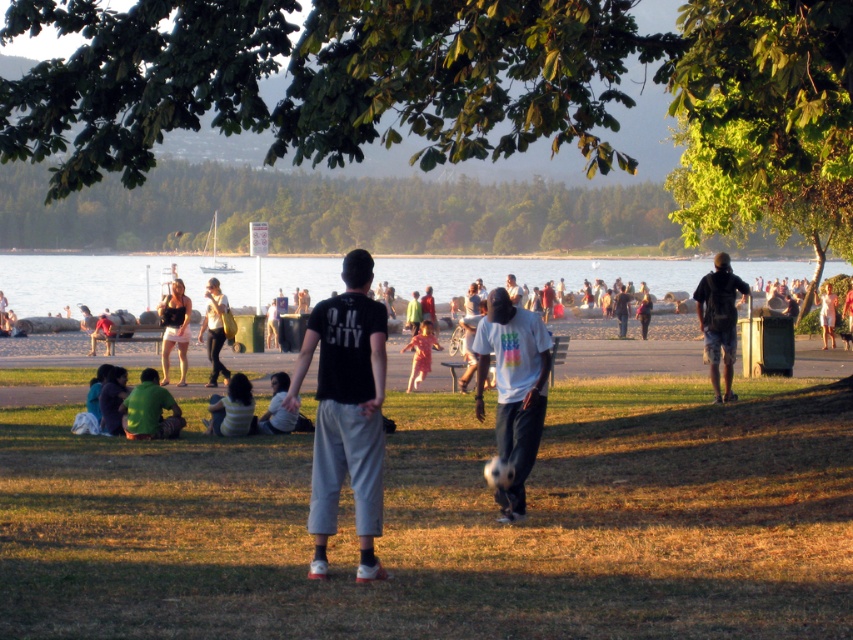
Based on the provided scene, what is the 2D coordinate of the clear blue water at center?

The clear blue water at center is located at the 2D coordinate point of [91,282].

In the scene shown: Where is the white matte shirt at center located in the image?

The white matte shirt at center is located at point coordinates of [514,388].